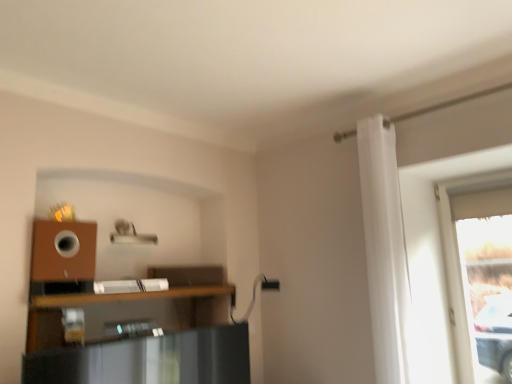
Question: From a real-world perspective, is brown wooden shelf at lower left positioned above or below transparent glass window at right?

Choices:
 (A) below
 (B) above

Answer: (A)

Question: From their relative heights in the image, would you say brown wooden shelf at lower left is taller or shorter than transparent glass window at right?

Choices:
 (A) tall
 (B) short

Answer: (B)

Question: Which object is the farthest from the brown wooden shelf at lower left?

Choices:
 (A) transparent glass window at right
 (B) white fabric curtain at right

Answer: (A)

Question: Which object is the closest to the white fabric curtain at right?

Choices:
 (A) brown wooden shelf at lower left
 (B) transparent glass window at right

Answer: (B)